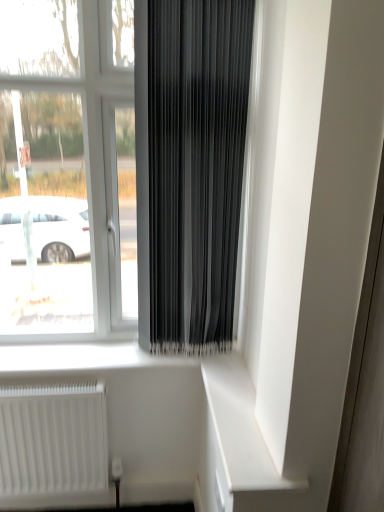
Question: Is black matte curtain at center shorter than transparent glass window at center?

Choices:
 (A) no
 (B) yes

Answer: (B)

Question: Can you confirm if black matte curtain at center is wider than transparent glass window at center?

Choices:
 (A) no
 (B) yes

Answer: (A)

Question: Does black matte curtain at center come behind transparent glass window at center?

Choices:
 (A) yes
 (B) no

Answer: (B)

Question: Is black matte curtain at center aimed at transparent glass window at center?

Choices:
 (A) no
 (B) yes

Answer: (A)

Question: Does black matte curtain at center have a lesser width compared to transparent glass window at center?

Choices:
 (A) no
 (B) yes

Answer: (B)

Question: Can you confirm if black matte curtain at center is smaller than transparent glass window at center?

Choices:
 (A) no
 (B) yes

Answer: (B)

Question: Can you confirm if white matte shelf at lower right is thinner than transparent glass window at center?

Choices:
 (A) no
 (B) yes

Answer: (B)

Question: Would you say white matte shelf at lower right is outside transparent glass window at center?

Choices:
 (A) no
 (B) yes

Answer: (B)

Question: Considering the relative positions of white matte shelf at lower right and transparent glass window at center in the image provided, is white matte shelf at lower right in front of transparent glass window at center?

Choices:
 (A) yes
 (B) no

Answer: (A)

Question: From the image's perspective, is white matte shelf at lower right beneath transparent glass window at center?

Choices:
 (A) yes
 (B) no

Answer: (A)

Question: Is white matte shelf at lower right bigger than transparent glass window at center?

Choices:
 (A) no
 (B) yes

Answer: (A)

Question: Is white matte shelf at lower right smaller than transparent glass window at center?

Choices:
 (A) no
 (B) yes

Answer: (B)

Question: From a real-world perspective, does transparent glass window at center sit lower than white matte radiator at lower left?

Choices:
 (A) yes
 (B) no

Answer: (B)